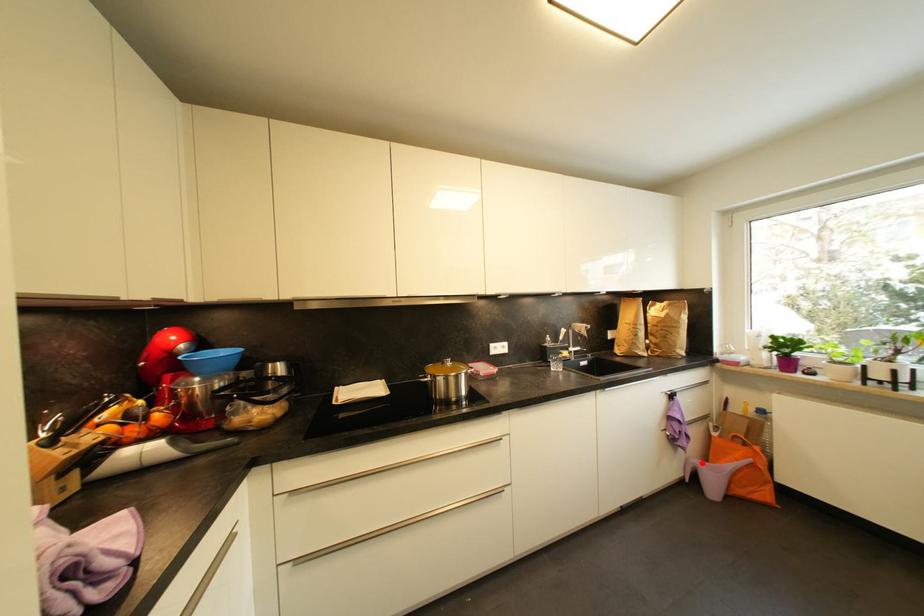
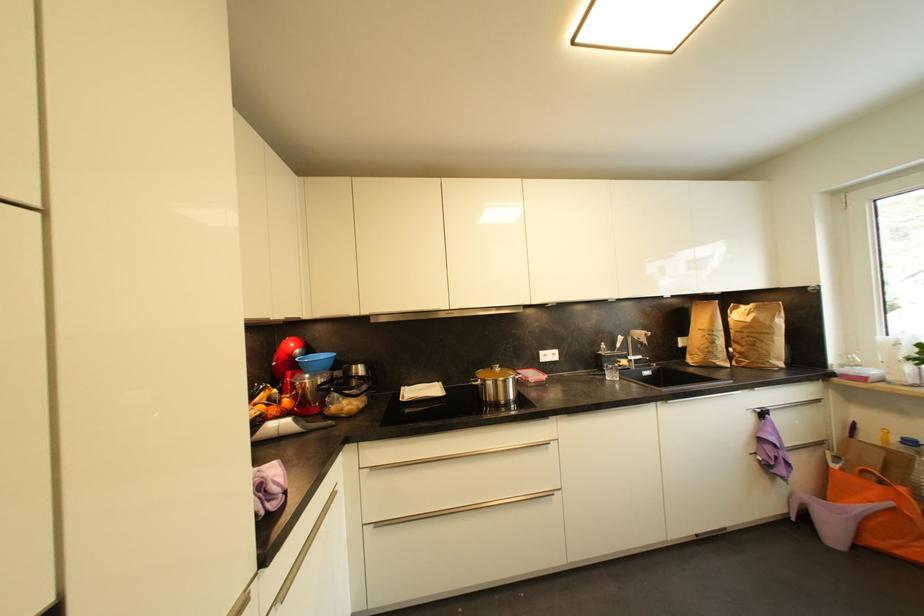
Question: I am providing you with two images of the same scene from different viewpoints. A red point is marked on the first image. Can you still see the location of the red point in image 2?

Choices:
 (A) Yes
 (B) No

Answer: (A)